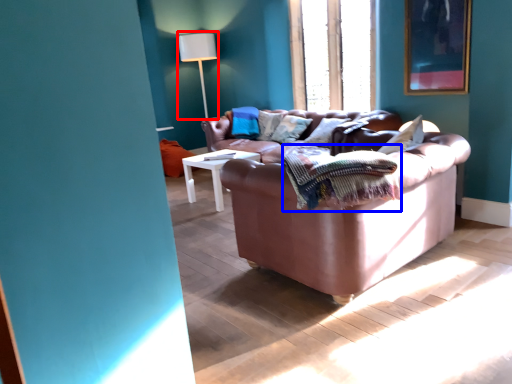
Question: Which object is further to the camera taking this photo, table lamp (highlighted by a red box) or blanket (highlighted by a blue box)?

Choices:
 (A) table lamp
 (B) blanket

Answer: (A)